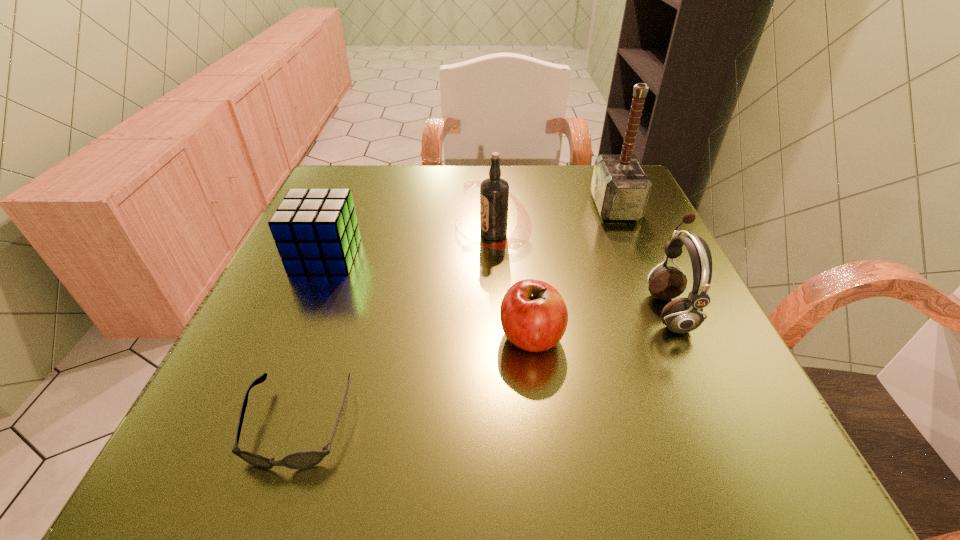
I want to click on the tallest object, so click(620, 187).

At what (x,y) coordinates should I click in order to perform the action: click on root beer. Please return your answer as a coordinate pair (x, y). Image resolution: width=960 pixels, height=540 pixels. Looking at the image, I should click on (494, 191).

I want to click on earphone, so click(682, 315).

The image size is (960, 540). I want to click on cube, so click(316, 231).

Locate an element on the screen. This screenshot has width=960, height=540. apple is located at coordinates (534, 317).

The height and width of the screenshot is (540, 960). Find the location of `the shortest object`. the shortest object is located at coordinates (306, 459).

At what (x,y) coordinates should I click in order to perform the action: click on the nearest object. Please return your answer as a coordinate pair (x, y). The width and height of the screenshot is (960, 540). Looking at the image, I should click on (306, 459).

At what (x,y) coordinates should I click in order to perform the action: click on vacant space located on the left of the hammer. Please return your answer as a coordinate pair (x, y). Looking at the image, I should click on (554, 207).

I want to click on vacant space situated on the label of the root beer, so click(373, 234).

Image resolution: width=960 pixels, height=540 pixels. Identify the location of vacant space situated on the label of the root beer. (321, 234).